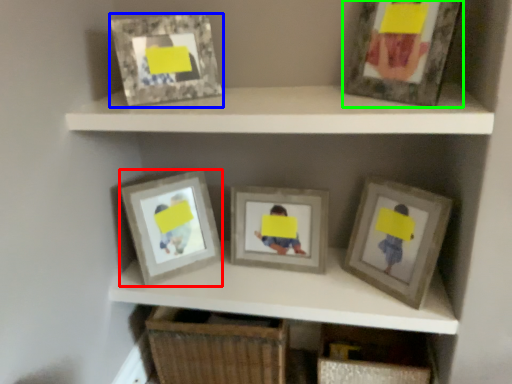
Question: Estimate the real-world distances between objects in this image. Which object is closer to picture frame (highlighted by a red box), picture frame (highlighted by a blue box) or picture frame (highlighted by a green box)?

Choices:
 (A) picture frame
 (B) picture frame

Answer: (A)